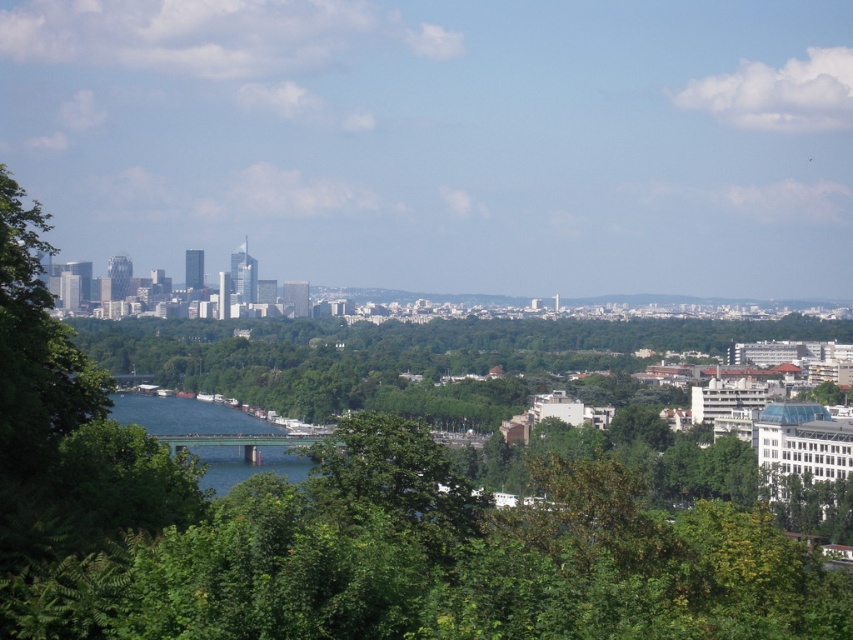
Question: Which object appears closest to the camera in this image?

Choices:
 (A) blue glassy water at center
 (B) green leafy trees at center

Answer: (B)

Question: Which object is farther from the camera taking this photo?

Choices:
 (A) green leafy trees at center
 (B) blue glassy water at center

Answer: (B)

Question: Does green leafy trees at center have a larger size compared to blue glassy water at center?

Choices:
 (A) no
 (B) yes

Answer: (B)

Question: Among these points, which one is nearest to the camera?

Choices:
 (A) (112, 406)
 (B) (650, 326)

Answer: (A)

Question: Is green leafy trees at center smaller than blue glassy water at center?

Choices:
 (A) no
 (B) yes

Answer: (A)

Question: Does green leafy trees at center lie behind blue glassy water at center?

Choices:
 (A) no
 (B) yes

Answer: (A)